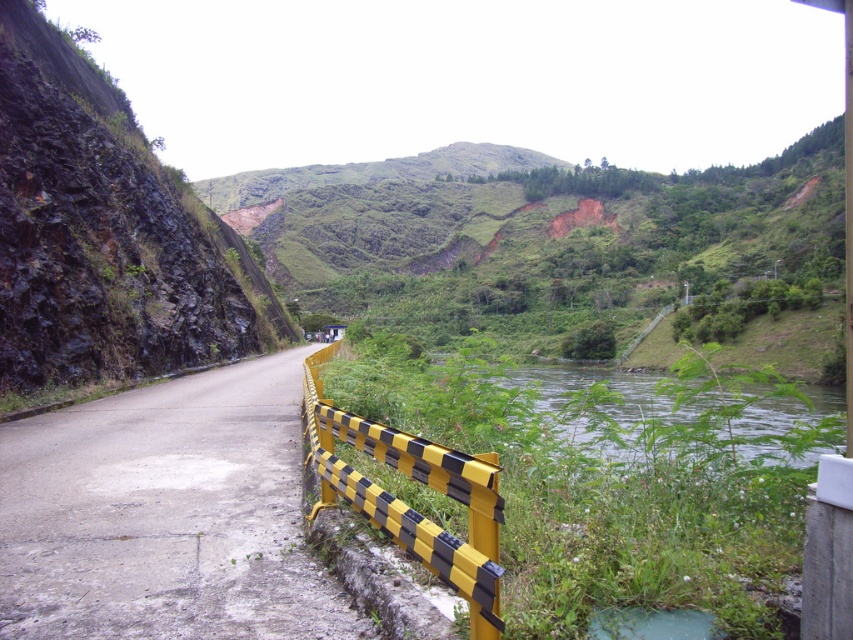
Question: Which of the following is the closest to the observer?

Choices:
 (A) green leafy river at center
 (B) yellow/black checkered barricade at lower center

Answer: (B)

Question: Which of these objects is positioned farthest from the green leafy river at center?

Choices:
 (A) yellow/black checkered barricade at lower center
 (B) dark rock cliff at left
 (C) asphalt road at left

Answer: (C)

Question: Considering the real-world distances, which object is farthest from the dark rock cliff at left?

Choices:
 (A) asphalt road at left
 (B) yellow/black checkered barricade at lower center
 (C) green leafy river at center

Answer: (C)

Question: Where is asphalt road at left located in relation to yellow/black checkered barricade at lower center in the image?

Choices:
 (A) above
 (B) below

Answer: (B)

Question: Can you confirm if dark rock cliff at left is positioned to the right of yellow/black checkered barricade at lower center?

Choices:
 (A) yes
 (B) no

Answer: (B)

Question: Is asphalt road at left positioned in front of green leafy river at center?

Choices:
 (A) no
 (B) yes

Answer: (A)